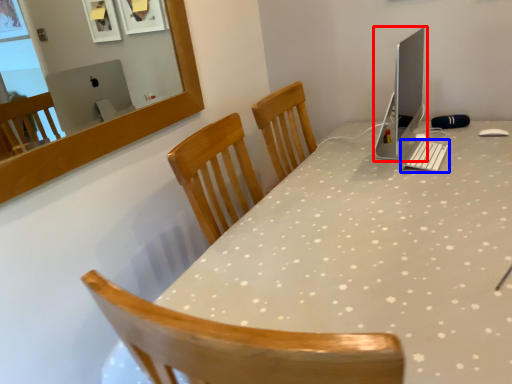
Question: Which point is further to the camera, computer monitor (highlighted by a red box) or keyboard (highlighted by a blue box)?

Choices:
 (A) computer monitor
 (B) keyboard

Answer: (B)